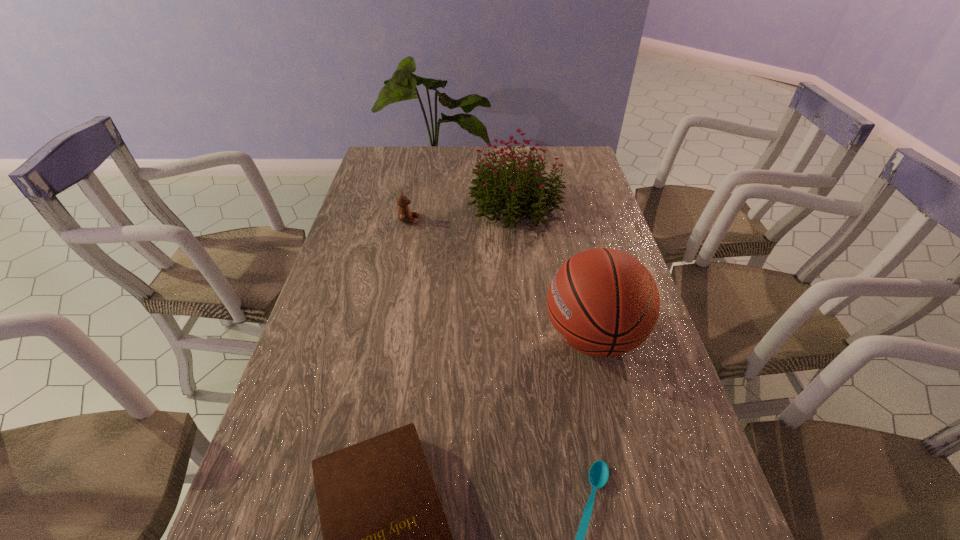
Identify which object is the third closest to the spoon. Please provide its 2D coordinates. Your answer should be formatted as a tuple, i.e. [(x, y)], where the tuple contains the x and y coordinates of a point satisfying the conditions above.

[(491, 181)]